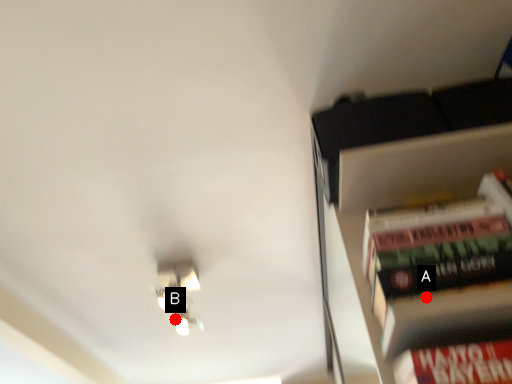
Question: Two points are circled on the image, labeled by A and B beside each circle. Which of the following is the closest to the observer?

Choices:
 (A) A is closer
 (B) B is closer

Answer: (A)